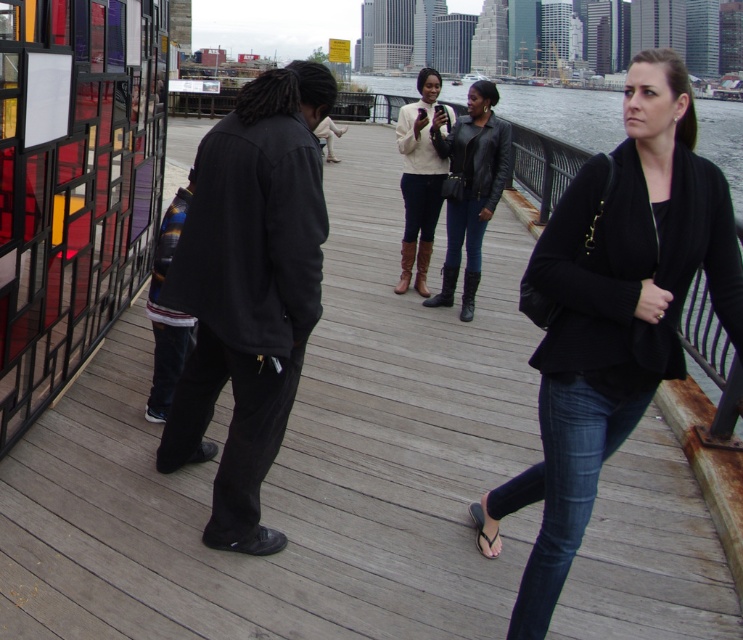
Who is shorter, black leather jacket at center or black matte jacket at center?

black leather jacket at center

Can you confirm if black leather jacket at center is positioned below black matte jacket at center?

No, black leather jacket at center is not below black matte jacket at center.

Between point (668, 106) and point (282, 257), which one is positioned behind?

The point (282, 257) is behind.

I want to click on black leather jacket at center, so click(614, 314).

Between point (265, 256) and point (457, 262), which one is positioned in front?

Point (265, 256) is more forward.

Is black matte jacket at center below leather jacket at center?

Yes, black matte jacket at center is below leather jacket at center.

Which is behind, point (259, 467) or point (509, 129)?

Point (509, 129)

Locate an element on the screen. black matte jacket at center is located at coordinates 247,289.

Is leather jacket at center closer to camera compared to matte white sweater at center?

Yes, leather jacket at center is closer to the viewer.

Is leather jacket at center bigger than matte white sweater at center?

Yes.

Does point (452, 272) lie in front of point (425, 262)?

Yes, it is.

Locate an element on the screen. The image size is (743, 640). leather jacket at center is located at coordinates (470, 188).